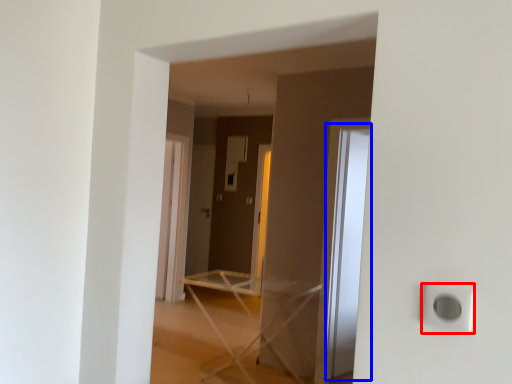
Question: Which point is further to the camera, electric outlet (highlighted by a red box) or glass door (highlighted by a blue box)?

Choices:
 (A) electric outlet
 (B) glass door

Answer: (B)